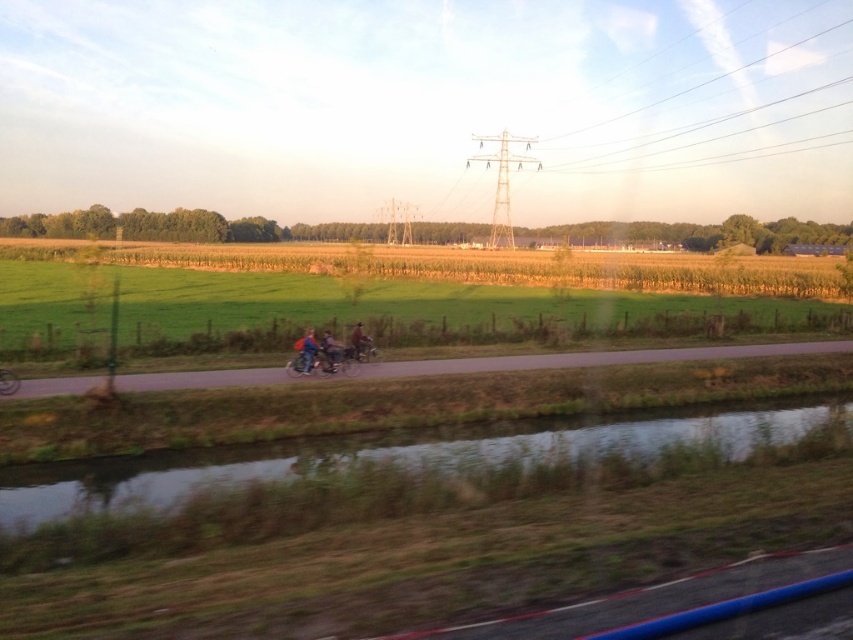
Question: Among these objects, which one is farthest from the camera?

Choices:
 (A) green grassy water at lower center
 (B) shiny metallic motorcycle at center

Answer: (B)

Question: Observing the image, what is the correct spatial positioning of green grassy water at lower center in reference to shiny metallic motorcycle at center?

Choices:
 (A) left
 (B) right

Answer: (B)

Question: Which point appears farthest from the camera in this image?

Choices:
 (A) (332, 358)
 (B) (643, 426)
 (C) (500, 275)

Answer: (C)

Question: Which of the following is the closest to the observer?

Choices:
 (A) shiny metallic motorcycle at center
 (B) green grass field at center
 (C) green grassy water at lower center

Answer: (C)

Question: Is green grass field at center positioned behind green grassy water at lower center?

Choices:
 (A) no
 (B) yes

Answer: (B)

Question: Does green grass field at center come in front of shiny metallic motorcycle at center?

Choices:
 (A) no
 (B) yes

Answer: (A)